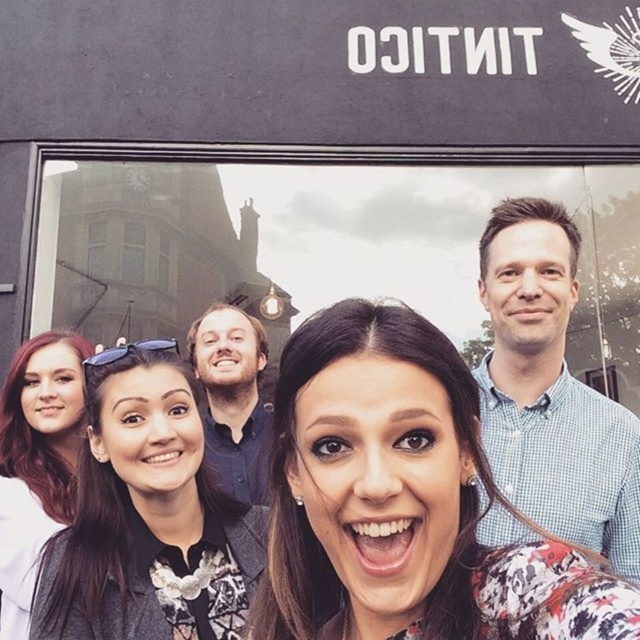
Question: Does floral fabric dress at center appear over blue checkered shirt at upper right?

Choices:
 (A) no
 (B) yes

Answer: (A)

Question: Does floral fabric dress at center have a larger size compared to matte black hair at left?

Choices:
 (A) no
 (B) yes

Answer: (B)

Question: Which point is farther to the camera?

Choices:
 (A) (525, 445)
 (B) (291, 544)

Answer: (A)

Question: Can you confirm if matte black jacket at center is bigger than matte black hair at left?

Choices:
 (A) no
 (B) yes

Answer: (B)

Question: Which object is positioned farthest from the matte black hair at left?

Choices:
 (A) matte black jacket at center
 (B) blue checkered shirt at upper right
 (C) floral fabric dress at center

Answer: (B)

Question: Which object appears farthest from the camera in this image?

Choices:
 (A) blue checkered shirt at upper right
 (B) matte black jacket at center

Answer: (A)